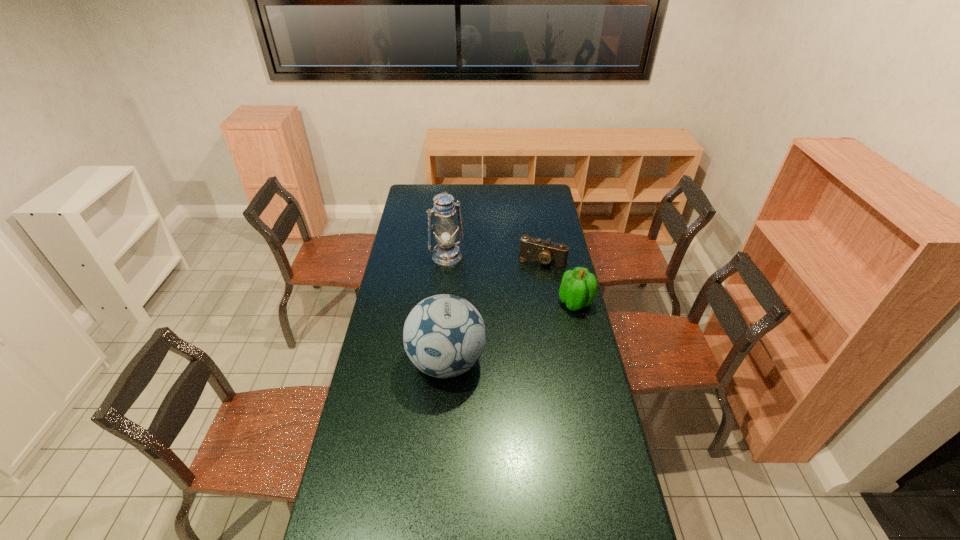
Identify the location of vacant region located 0.200m on the front-facing side of the tallest object. The width and height of the screenshot is (960, 540). (472, 289).

Locate an element on the screen. This screenshot has height=540, width=960. free region located on the front-facing side of the camera is located at coordinates (530, 280).

Identify the location of free space located 0.400m on the front-facing side of the camera. This screenshot has height=540, width=960. (508, 323).

Where is `free spot located on the front-facing side of the camera`? free spot located on the front-facing side of the camera is located at coordinates (510, 320).

This screenshot has height=540, width=960. Identify the location of bell pepper at the right edge. (578, 289).

You are a GUI agent. You are given a task and a screenshot of the screen. Output one action in this format:
    pyautogui.click(x=<x>, y=<y>)
    Task: Click on the camera at the right edge
    The width and height of the screenshot is (960, 540).
    Given the screenshot: What is the action you would take?
    pyautogui.click(x=547, y=252)

Identify the location of vacant space at the far edge of the desktop. (458, 198).

This screenshot has height=540, width=960. What are the coordinates of `vacant space at the near edge of the desktop` in the screenshot? It's located at (387, 528).

Find the location of `free space at the left edge of the desktop`. free space at the left edge of the desktop is located at coordinates (403, 209).

This screenshot has width=960, height=540. In the image, there is a desktop. Identify the location of vacant space at the right edge. (553, 303).